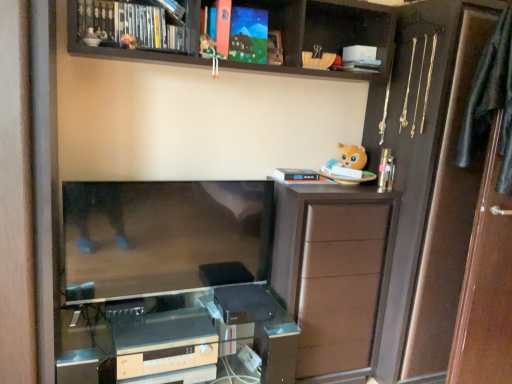
Locate an element on the screen. The image size is (512, 384). vacant space underneath white matte book at upper center, the 4th book when ordered from left to right (from a real-world perspective) is located at coordinates (308, 178).